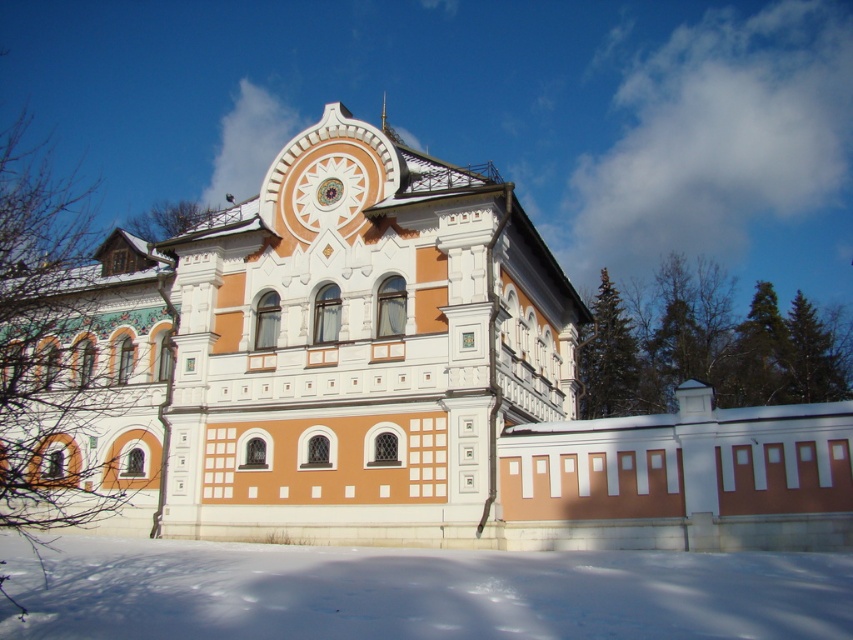
Is orange painted stone palace at center wider than white powdery snow at lower center?

Yes.

Is orange painted stone palace at center smaller than white powdery snow at lower center?

Actually, orange painted stone palace at center might be larger than white powdery snow at lower center.

Find the location of a particular element. This screenshot has width=853, height=640. orange painted stone palace at center is located at coordinates (393, 381).